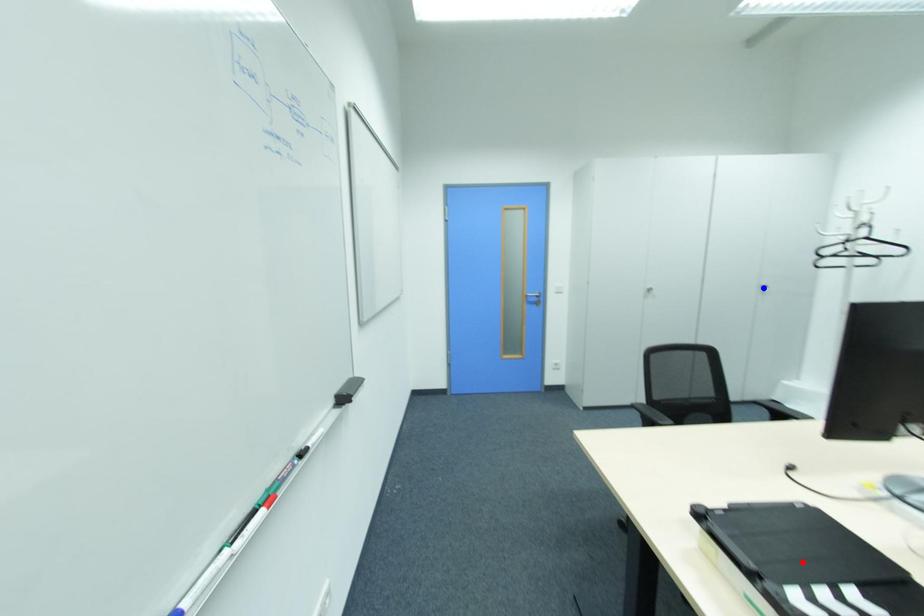
Question: Two points are marked on the image. Which point is closer to the camera?

Choices:
 (A) Blue point is closer.
 (B) Red point is closer.

Answer: (B)